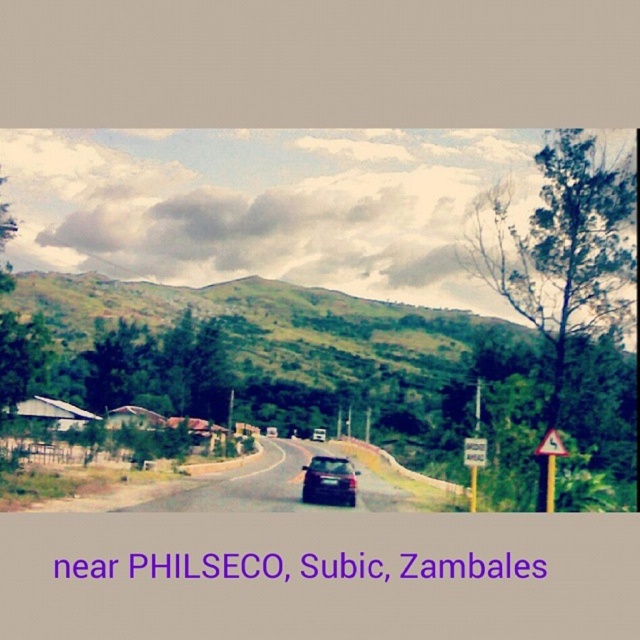
You are driving a car and see the scene described. There is a point marked at coordinates (328, 481). What object is located at that point?

The point at coordinates (328, 481) indicates a satin black car at center.

You are driving a car and see the satin black car at center and the yellow plastic triangle at right. Which object is closer to the bottom edge of the image?

The satin black car at center is closer to the bottom edge of the image because it is positioned below the yellow plastic triangle at right.

You are driving a car and see the satin black car at center and the yellow plastic triangle at right. Which object is farther from you?

The yellow plastic triangle at right is farther from you because it is positioned behind the satin black car at center.